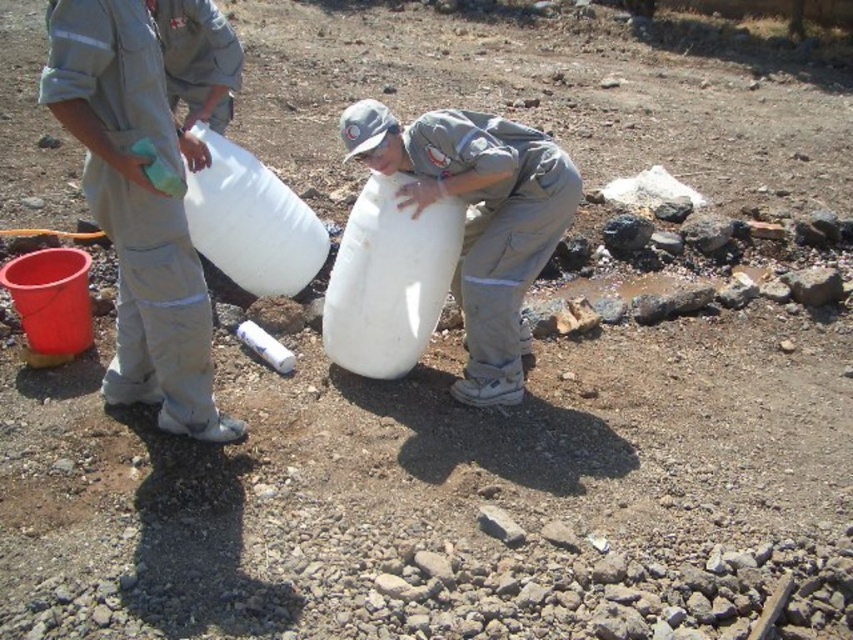
Question: Does light gray uniform at left appear over white matte container at center?

Choices:
 (A) no
 (B) yes

Answer: (A)

Question: Which point is farther to the camera?

Choices:
 (A) (459, 156)
 (B) (117, 125)

Answer: (A)

Question: Which object is farther from the camera taking this photo?

Choices:
 (A) white matte container at center
 (B) light gray uniform at left

Answer: (A)

Question: Does light gray uniform at left appear over white matte container at center?

Choices:
 (A) yes
 (B) no

Answer: (B)

Question: In this image, where is light gray uniform at left located relative to white matte container at center?

Choices:
 (A) right
 (B) left

Answer: (B)